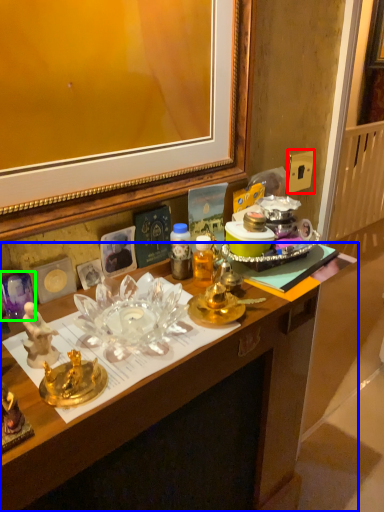
Question: Estimate the real-world distances between objects in this image. Which object is farther from power outlet (highlighted by a red box), desk (highlighted by a blue box) or plate (highlighted by a green box)?

Choices:
 (A) desk
 (B) plate

Answer: (B)